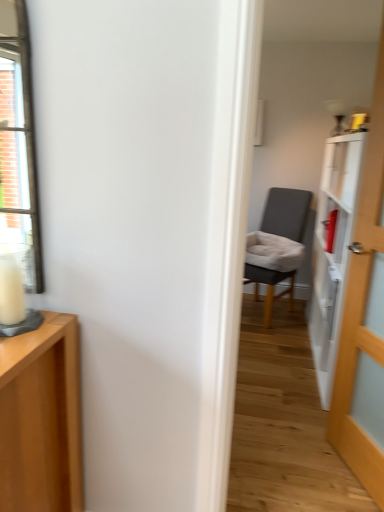
You are a GUI agent. You are given a task and a screenshot of the screen. Output one action in this format:
    pyautogui.click(x=<x>, y=<y>)
    Task: Click on the vacant area situated to the left side of wooden door at right
    This screenshot has height=512, width=384.
    Given the screenshot: What is the action you would take?
    pyautogui.click(x=302, y=469)